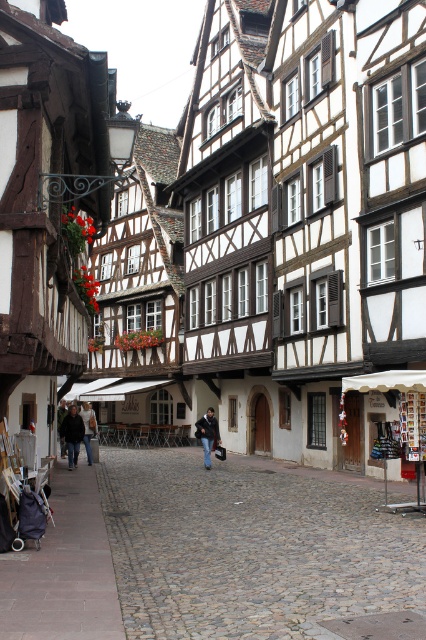
Question: Can you confirm if dark purple fabric baby carriage at lower left is thinner than dark blue jeans at lower left?

Choices:
 (A) yes
 (B) no

Answer: (B)

Question: Among these objects, which one is nearest to the camera?

Choices:
 (A) dark blue jeans at lower left
 (B) denim jeans at center
 (C) dark gray sweater at center

Answer: (B)

Question: Estimate the real-world distances between objects in this image. Which object is farther from the dark gray sweater at center?

Choices:
 (A) dark blue jeans at lower left
 (B) cobblestone street at center
 (C) denim jeans at center
 (D) dark purple fabric baby carriage at lower left

Answer: (D)

Question: Can you confirm if cobblestone street at center is positioned to the left of denim jeans at center?

Choices:
 (A) no
 (B) yes

Answer: (A)

Question: Is dark purple fabric baby carriage at lower left above dark gray sweater at center?

Choices:
 (A) yes
 (B) no

Answer: (A)

Question: Estimate the real-world distances between objects in this image. Which object is farther from the denim jeans at center?

Choices:
 (A) dark purple fabric baby carriage at lower left
 (B) cobblestone street at center
 (C) dark gray sweater at center

Answer: (A)